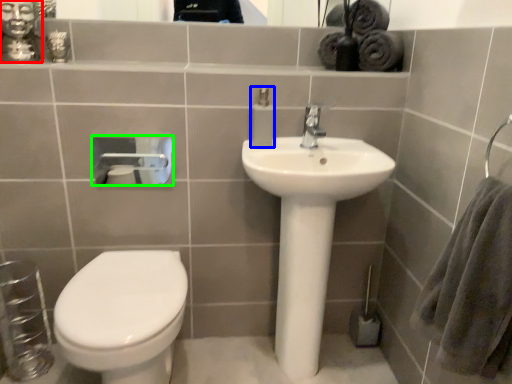
Question: Based on their relative distances, which object is farther from selfie (highlighted by a red box)? Choose from soap dispenser (highlighted by a blue box) and toilet paper (highlighted by a green box).

Choices:
 (A) soap dispenser
 (B) toilet paper

Answer: (B)